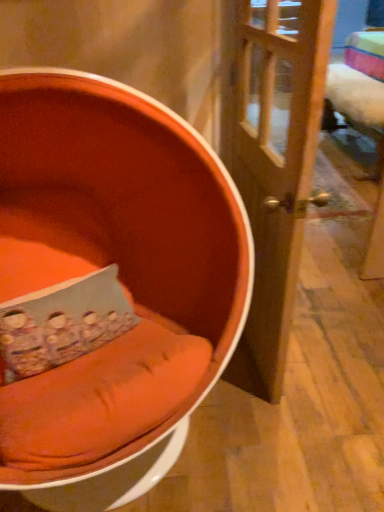
Question: Is floral fabric pillow at center smaller than wooden door at center?

Choices:
 (A) yes
 (B) no

Answer: (A)

Question: Is the position of floral fabric pillow at center less distant than that of wooden door at center?

Choices:
 (A) no
 (B) yes

Answer: (A)

Question: From the image's perspective, does floral fabric pillow at center appear lower than wooden door at center?

Choices:
 (A) yes
 (B) no

Answer: (A)

Question: Is wooden door at center at the back of floral fabric pillow at center?

Choices:
 (A) yes
 (B) no

Answer: (B)

Question: From a real-world perspective, is floral fabric pillow at center over wooden door at center?

Choices:
 (A) yes
 (B) no

Answer: (B)

Question: Is wooden door at center taller or shorter than orange fabric chair at left?

Choices:
 (A) short
 (B) tall

Answer: (B)

Question: Looking at the image, does wooden door at center seem bigger or smaller compared to orange fabric chair at left?

Choices:
 (A) big
 (B) small

Answer: (B)

Question: Is point (259, 166) positioned closer to the camera than point (99, 301)?

Choices:
 (A) closer
 (B) farther

Answer: (A)

Question: From the image's perspective, is wooden door at center positioned above or below orange fabric chair at left?

Choices:
 (A) above
 (B) below

Answer: (A)

Question: In terms of height, does wooden door at center look taller or shorter compared to floral fabric pillow at center?

Choices:
 (A) short
 (B) tall

Answer: (B)

Question: Considering their positions, is wooden door at center located in front of or behind floral fabric pillow at center?

Choices:
 (A) behind
 (B) front

Answer: (B)

Question: Is wooden door at center bigger or smaller than floral fabric pillow at center?

Choices:
 (A) big
 (B) small

Answer: (A)

Question: Considering the relative positions of wooden door at center and floral fabric pillow at center in the image provided, is wooden door at center to the left or to the right of floral fabric pillow at center?

Choices:
 (A) right
 (B) left

Answer: (A)

Question: In the image, is orange fabric chair at left on the left side or the right side of wooden door at center?

Choices:
 (A) left
 (B) right

Answer: (A)

Question: Looking at the image, does orange fabric chair at left seem bigger or smaller compared to wooden door at center?

Choices:
 (A) small
 (B) big

Answer: (B)